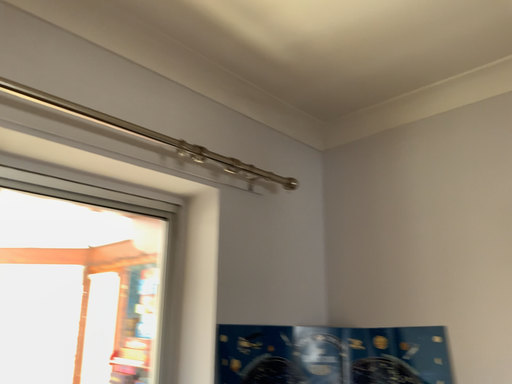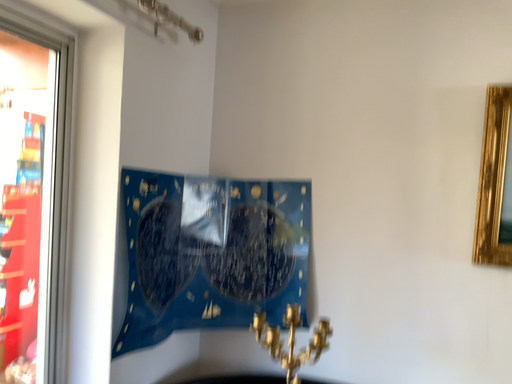
Question: Which way did the camera rotate in the video?

Choices:
 (A) rotated downward
 (B) rotated upward

Answer: (A)